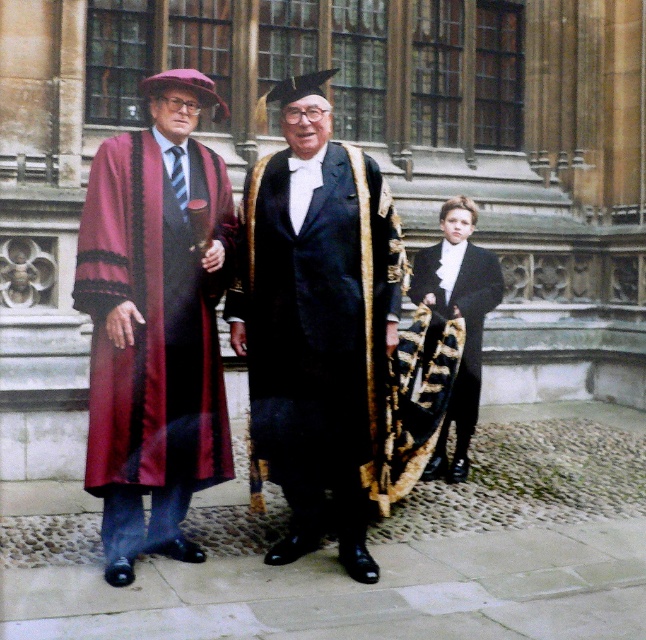
You are an event planner arranging seating for a ceremony. The maroon satin robe at left and the black satin tuxedo at center are two guests. Which guest requires more space due to their attire?

The maroon satin robe at left requires more space because it has a larger size compared to the black satin tuxedo at center.